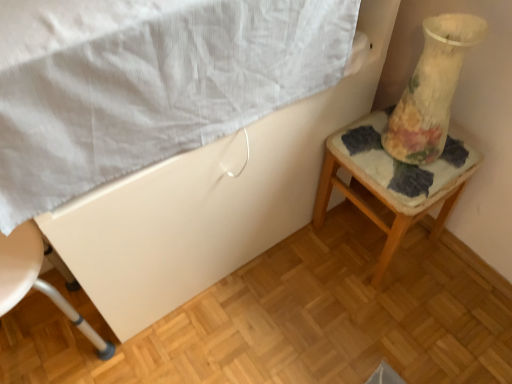
Image resolution: width=512 pixels, height=384 pixels. I want to click on vacant space to the right of white plastic chair at lower left, so click(156, 349).